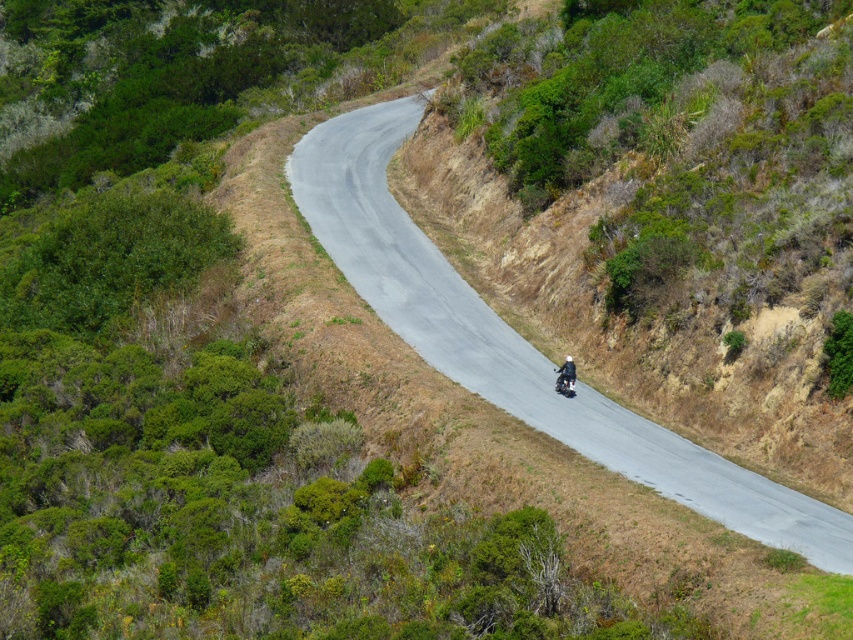
Question: Can you confirm if gray asphalt road at center is positioned below shiny black motorcycle at center?

Choices:
 (A) yes
 (B) no

Answer: (B)

Question: Considering the relative positions of gray asphalt road at center and shiny black motorcycle at center in the image provided, where is gray asphalt road at center located with respect to shiny black motorcycle at center?

Choices:
 (A) left
 (B) right

Answer: (A)

Question: Which of the following is the farthest from the observer?

Choices:
 (A) shiny black motorcycle at center
 (B) gray asphalt road at center

Answer: (A)

Question: Which point is farther to the camera?

Choices:
 (A) (390, 221)
 (B) (561, 390)

Answer: (A)

Question: Which point is farther from the camera taking this photo?

Choices:
 (A) (302, 161)
 (B) (572, 385)

Answer: (A)

Question: Does gray asphalt road at center have a smaller size compared to shiny black motorcycle at center?

Choices:
 (A) yes
 (B) no

Answer: (B)